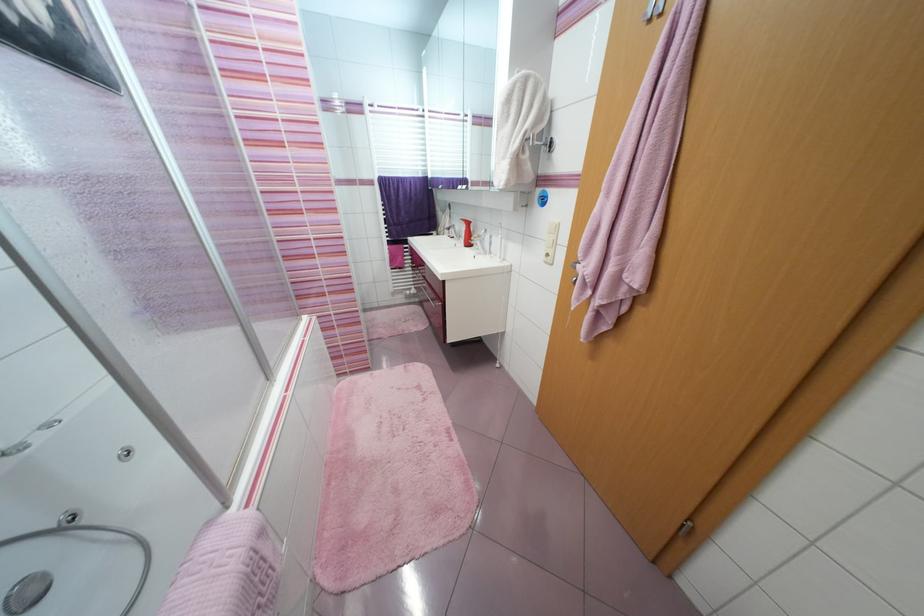
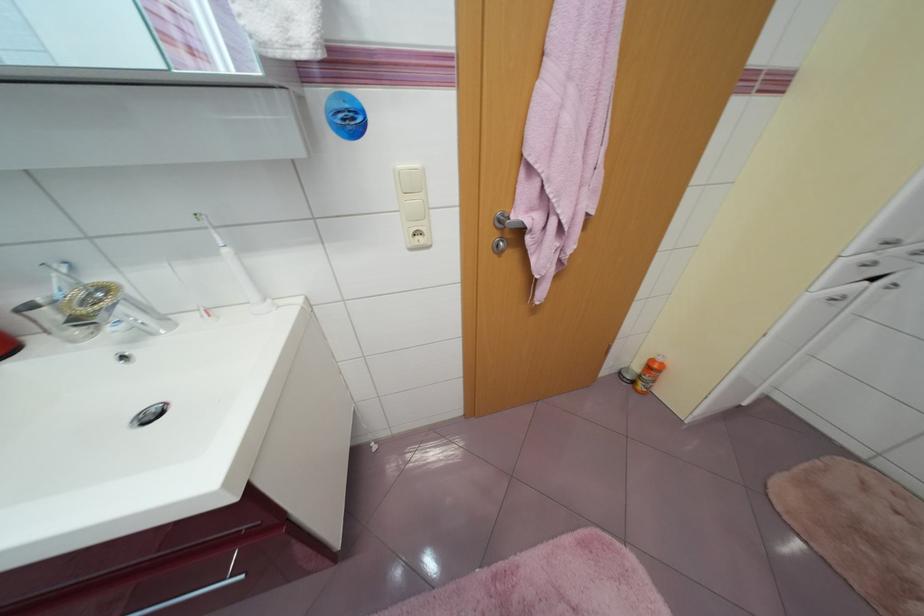
Where in the second image is the point corresponding to pixel 553 259 from the first image?

(423, 238)